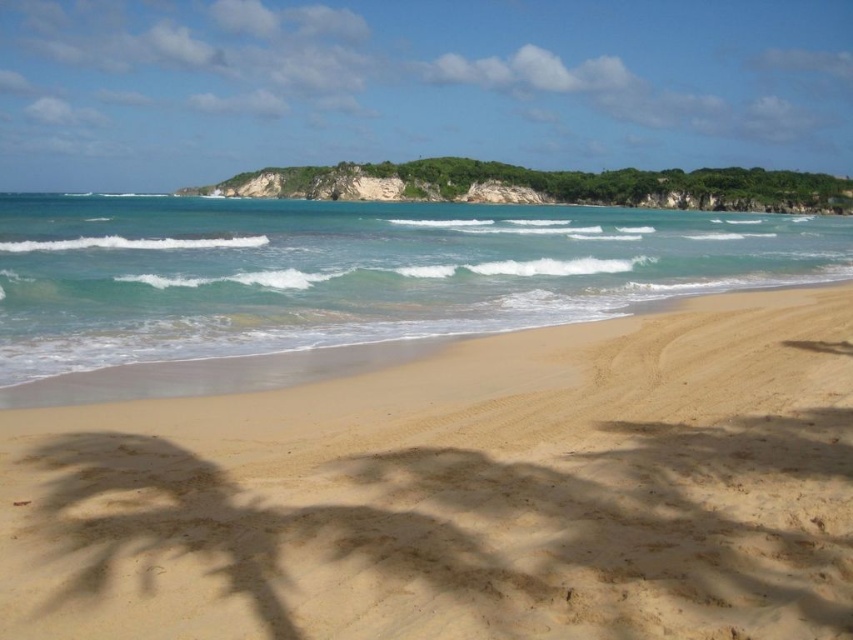
Question: Does golden sand at center appear under green leafy island at center?

Choices:
 (A) no
 (B) yes

Answer: (B)

Question: Which point appears closest to the camera in this image?

Choices:
 (A) (851, 435)
 (B) (485, 198)

Answer: (A)

Question: Which point is closer to the camera?

Choices:
 (A) (839, 188)
 (B) (514, 385)

Answer: (B)

Question: Is golden sand at center to the right of green leafy island at center from the viewer's perspective?

Choices:
 (A) no
 (B) yes

Answer: (B)

Question: Can you confirm if golden sand at center is smaller than green leafy island at center?

Choices:
 (A) no
 (B) yes

Answer: (B)